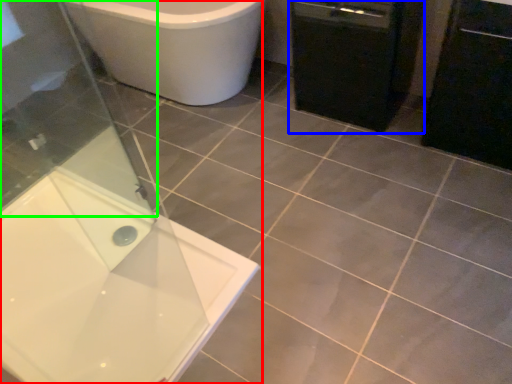
Question: Which object is positioned farthest from bathtub (highlighted by a red box)? Select from dish washer (highlighted by a blue box) and screen door (highlighted by a green box).

Choices:
 (A) dish washer
 (B) screen door

Answer: (A)